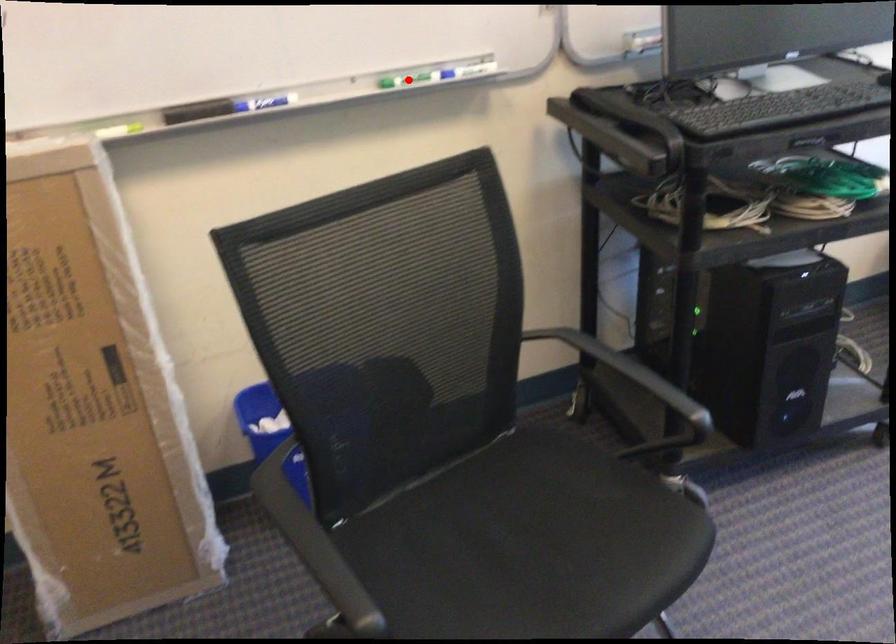
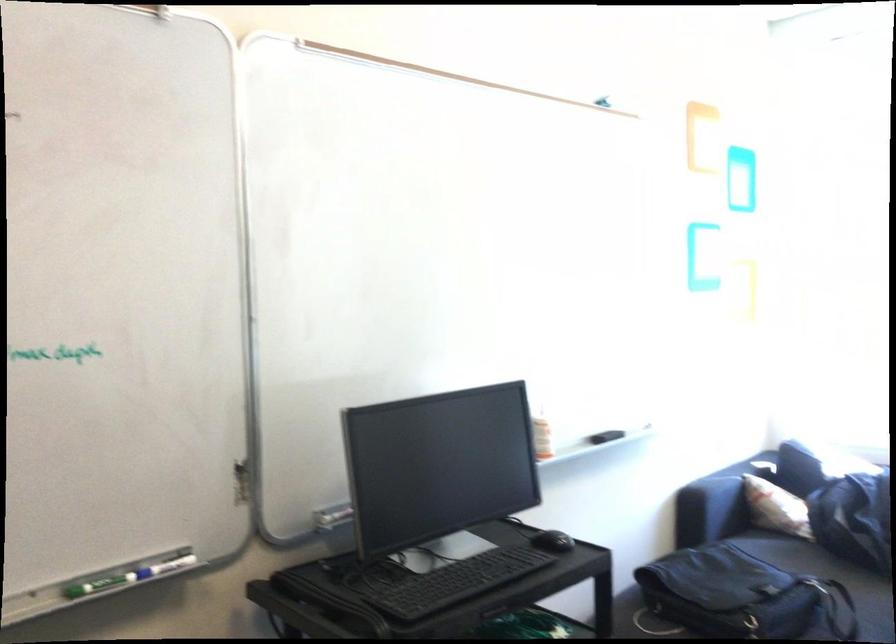
In the second image, find the point that corresponds to the highlighted location in the first image.

(96, 585)